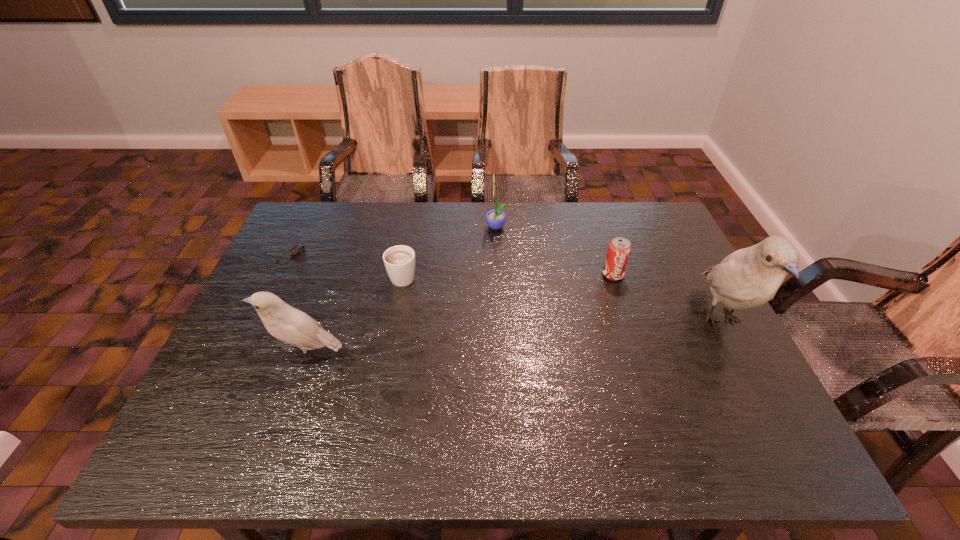
Find the location of a particular element. vacant point at the near edge is located at coordinates (386, 393).

Identify the location of vacant area at the left edge of the desktop. (242, 356).

Find the location of a particular element. Image resolution: width=960 pixels, height=540 pixels. blank space at the right edge is located at coordinates (686, 324).

Find the location of `free spot at the far left corner of the desktop`. free spot at the far left corner of the desktop is located at coordinates (335, 219).

The width and height of the screenshot is (960, 540). In the image, there is a desktop. Find the location of `vacant space at the far right corner`. vacant space at the far right corner is located at coordinates (637, 205).

Find the location of `free space at the near right corner`. free space at the near right corner is located at coordinates (696, 403).

At what (x,y) coordinates should I click in order to perform the action: click on vacant space in between the shorter bird and the taller bird. Please return your answer as a coordinate pair (x, y). This screenshot has height=540, width=960. Looking at the image, I should click on (514, 336).

What are the coordinates of `empty space between the rightmost object and the mouse` in the screenshot? It's located at (506, 287).

Identify the location of vacant space that's between the shorter bird and the soda can. The height and width of the screenshot is (540, 960). coord(460,314).

This screenshot has width=960, height=540. Identify the location of empty location between the third shortest object and the left bird. (460, 314).